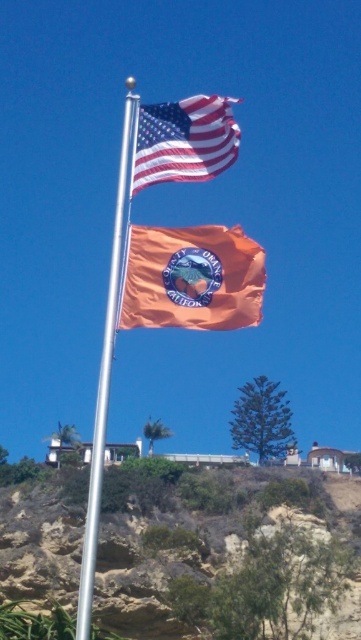
Looking at this image, you are a photographer trying to capture both the american flag at upper center and the silver metallic flag pole at center in a single shot. Based on their sizes, which object will appear smaller in the photo?

The american flag at upper center will appear smaller in the photo because it has a lesser width compared to the silver metallic flag pole at center.

You are a photographer trying to capture both the american flag at upper center and the silver metallic flag pole at center in a single frame. Based on their heights, which object will appear taller in your photo?

The silver metallic flag pole at center will appear taller in the photo because the american flag at upper center has a lesser height compared to it.